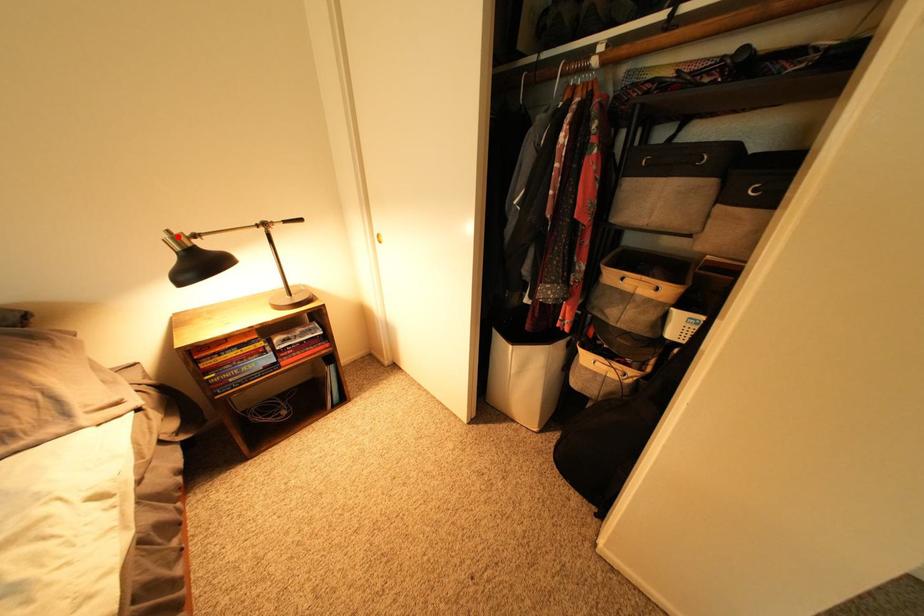
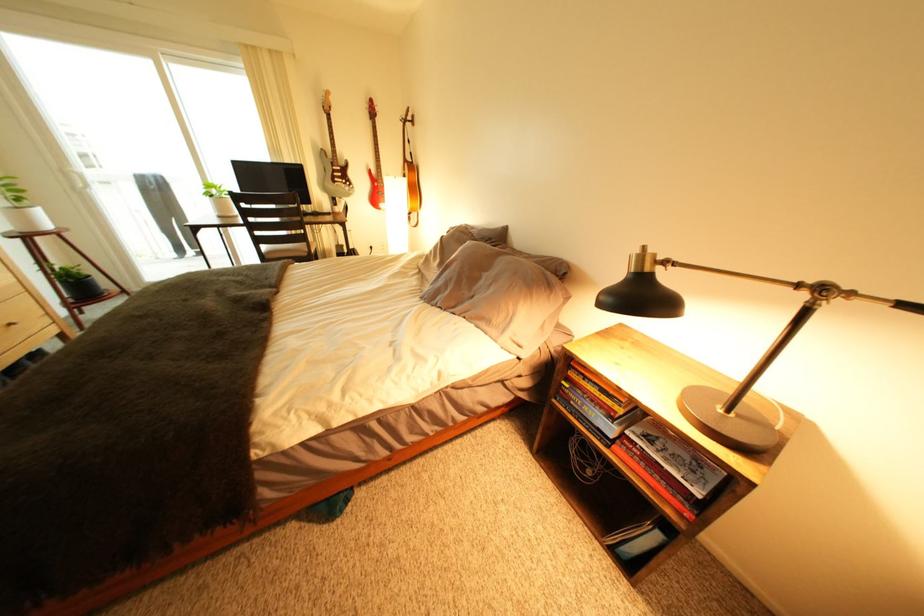
Where in the second image is the point corresponding to the highlighted location from the first image?

(650, 253)